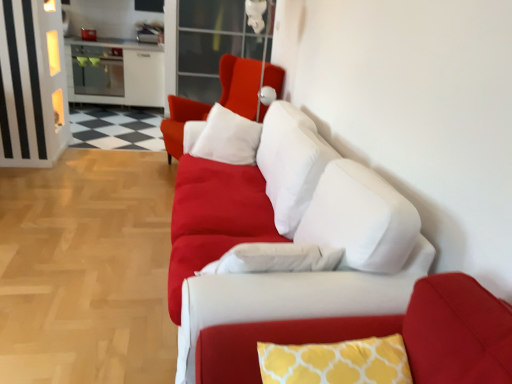
Question: From a real-world perspective, is white glossy cabinet at upper left above or below matte white cushion at center?

Choices:
 (A) above
 (B) below

Answer: (B)

Question: Looking at the image, does white glossy cabinet at upper left seem bigger or smaller compared to matte white cushion at center?

Choices:
 (A) big
 (B) small

Answer: (A)

Question: Which is farther from the transparent glass door at upper center?

Choices:
 (A) white glossy cabinet at upper left
 (B) white soft pillow at center
 (C) matte white cushion at center
 (D) yellow printed cushion at center
 (E) matte white couch at center

Answer: (D)

Question: Which object is the farthest from the white soft pillow at center?

Choices:
 (A) yellow printed cushion at center
 (B) transparent glass door at upper center
 (C) white glossy cabinet at upper left
 (D) matte white cushion at center
 (E) matte white couch at center

Answer: (C)